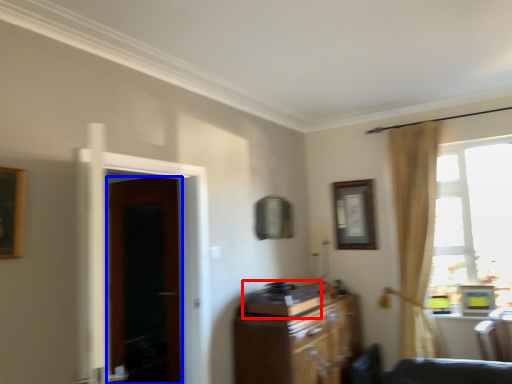
Question: Among these objects, which one is nearest to the camera, appliance (highlighted by a red box) or door (highlighted by a blue box)?

Choices:
 (A) appliance
 (B) door

Answer: (A)